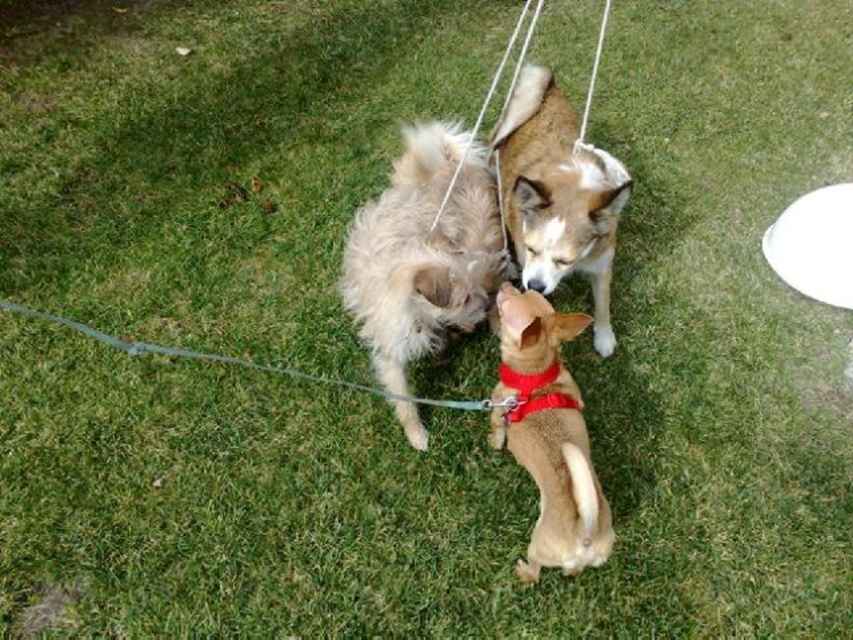
You are a dog trainer observing the scene. You need to determine if the two dogs at the center are close enough to interact without any physical barriers. The minimum safe distance for interaction between dogs is 12 inches. Can the fuzzy beige dog at center and the brown fur dog at center interact safely?

The fuzzy beige dog at center and the brown fur dog at center are 14.04 inches apart, which is greater than the minimum safe distance of 12 inches. Therefore, they can interact safely without any physical barriers.

You are a dog trainer observing the scene. You need to determine which dog requires a larger size harness. Based on the description of the fuzzy beige dog at center and the brown soft fur dog at center, which dog would need the bigger harness?

The fuzzy beige dog at center is larger in size than the brown soft fur dog at center, so it would require a larger size harness.

In the scene shown: You are a dog owner trying to fit both the fuzzy beige dog at center and the brown fur dog at center into a dog carrier that can only accommodate the wider of the two. Which dog should you prioritize placing first?

The fuzzy beige dog at center is wider than the brown fur dog at center, so you should prioritize placing the fuzzy beige dog at center first to ensure it fits properly in the carrier.